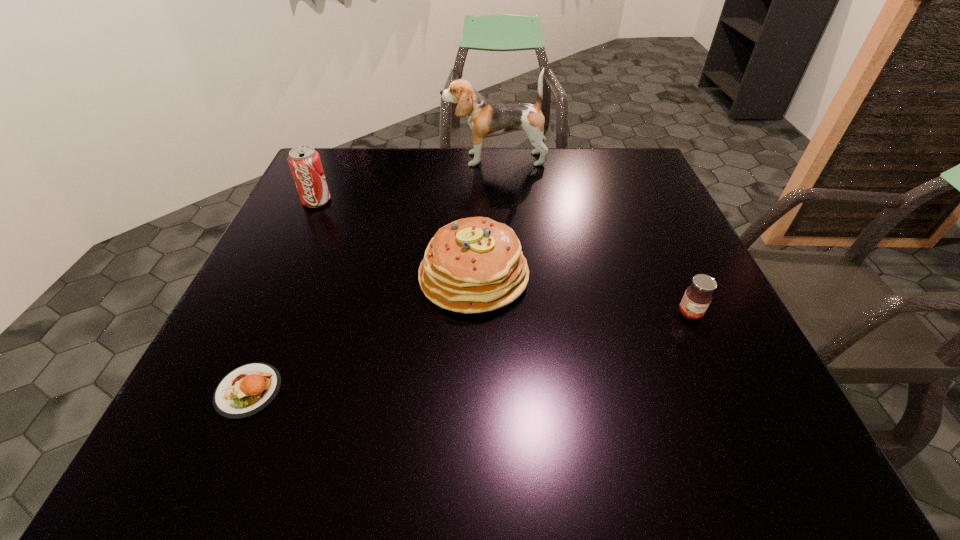
At what (x,y) coordinates should I click in order to perform the action: click on empty space that is in between the soda can and the shortest object. Please return your answer as a coordinate pair (x, y). This screenshot has width=960, height=540. Looking at the image, I should click on (282, 296).

At what (x,y) coordinates should I click in order to perform the action: click on free spot between the third tallest object and the nearest object. Please return your answer as a coordinate pair (x, y). Looking at the image, I should click on (361, 334).

In order to click on free space between the pancake and the rightmost object in this screenshot , I will do `click(582, 295)`.

The width and height of the screenshot is (960, 540). Identify the location of blank region between the patty (food) and the fourth shortest object. (282, 296).

Image resolution: width=960 pixels, height=540 pixels. Identify the location of object that stands as the fourth closest to the puppy. (245, 391).

The width and height of the screenshot is (960, 540). I want to click on object that is the third closest one to the second shortest object, so click(x=245, y=391).

You are a GUI agent. You are given a task and a screenshot of the screen. Output one action in this format:
    pyautogui.click(x=<x>, y=<y>)
    Task: Click on the free space that satisfies the following two spatial constraints: 1. at the face of the puppy; 2. on the front side of the patty (food)
    Image resolution: width=960 pixels, height=540 pixels.
    Given the screenshot: What is the action you would take?
    pyautogui.click(x=506, y=390)

You are a GUI agent. You are given a task and a screenshot of the screen. Output one action in this format:
    pyautogui.click(x=<x>, y=<y>)
    Task: Click on the vacant space that satisfies the following two spatial constraints: 1. at the face of the puppy; 2. on the front side of the fourth shortest object
    
    Given the screenshot: What is the action you would take?
    pyautogui.click(x=496, y=201)

Locate an element on the screen. The height and width of the screenshot is (540, 960). free region that satisfies the following two spatial constraints: 1. at the face of the puppy; 2. on the front side of the third tallest object is located at coordinates (500, 277).

Identify the location of blank area in the image that satisfies the following two spatial constraints: 1. at the face of the puppy; 2. on the front side of the third tallest object. (500, 277).